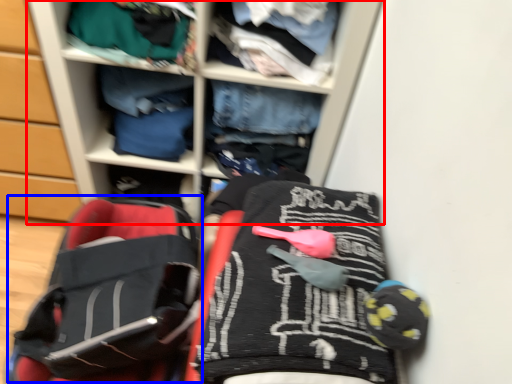
Question: Among these objects, which one is farthest to the camera, shelf (highlighted by a red box) or baby carriage (highlighted by a blue box)?

Choices:
 (A) shelf
 (B) baby carriage

Answer: (B)